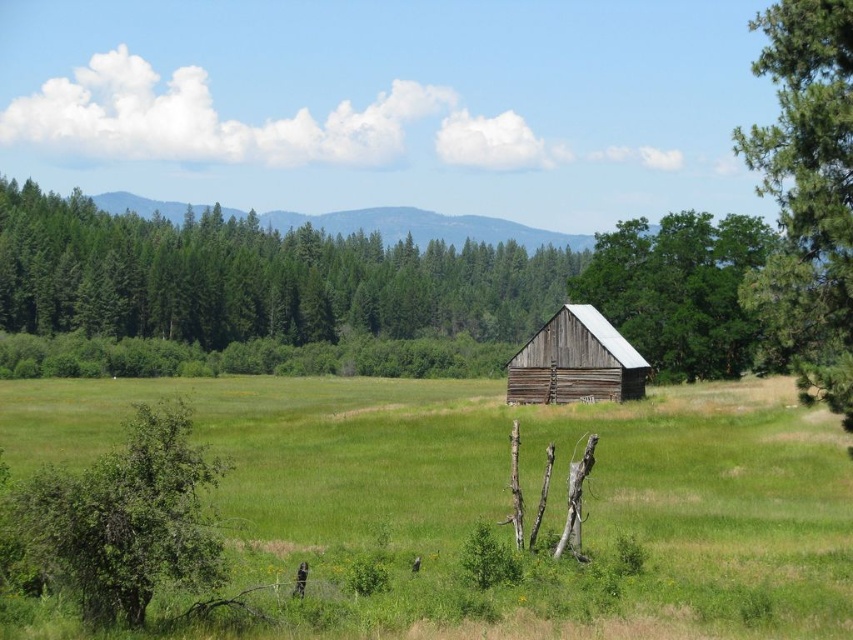
Question: From the image, what is the correct spatial relationship of green grassy pasture at center in relation to green textured trees at upper left?

Choices:
 (A) left
 (B) right

Answer: (B)

Question: Which object appears closest to the camera in this image?

Choices:
 (A) green textured pine tree at right
 (B) green rough wood barn at center
 (C) green textured trees at upper left
 (D) green leafy tree at lower left

Answer: (D)

Question: Does green leafy tree at lower left have a greater width compared to green rough wood barn at center?

Choices:
 (A) yes
 (B) no

Answer: (B)

Question: Can you confirm if green grassy pasture at center is positioned above green textured pine tree at right?

Choices:
 (A) no
 (B) yes

Answer: (A)

Question: Which object is farther from the camera taking this photo?

Choices:
 (A) green rough wood barn at center
 (B) green textured trees at upper left

Answer: (B)

Question: Which object is closer to the camera taking this photo?

Choices:
 (A) green rough wood barn at center
 (B) green leafy tree at lower left
 (C) green textured trees at upper left

Answer: (B)